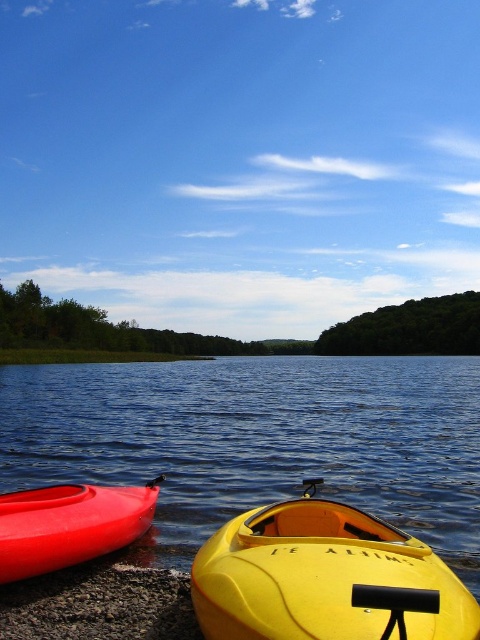
You are planning to take a photo of the blue glossy water at lower left and the matte red canoe at lower left. Since you want both to be in focus, which object should you position closer to the camera to ensure depth of field?

The matte red canoe at lower left is behind blue glossy water at lower left, so to ensure both are in focus, position the blue glossy water at lower left closer to the camera.

In the scene shown: You are standing on the lakeside and want to reach the yellow matte kayak at lower center to start your paddle. Considering your height is 5 feet 6 inches, can you comfortably step into it from the pebbled shoreline without needing to bend down too much?

The yellow matte kayak at lower center is 8.67 feet away from you. Since the distance is manageable, you can comfortably step into it without bending down excessively.